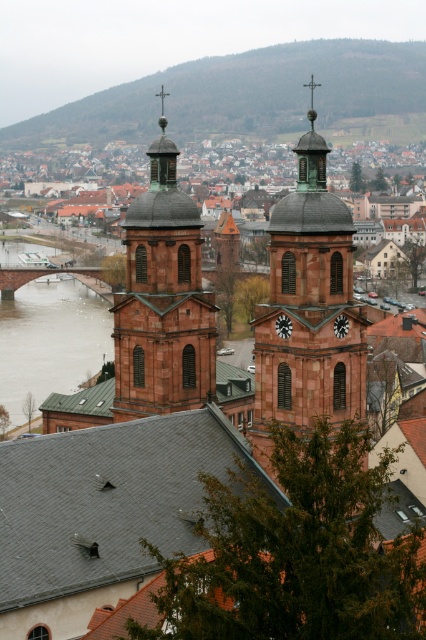
You are standing in the town square and want to take a photo of the brown stone church towers at center. If you move 0.1 units to the right along the x axis, will the towers still be in the frame?

The brown stone church towers at center are located at point (77, 182). Moving 0.1 units to the right along the x axis would shift your position, but since the towers are centrally positioned and the scene includes the entire town, they would likely remain within the frame. However, precise framing depends on the camera angle and zoom level not specified here.